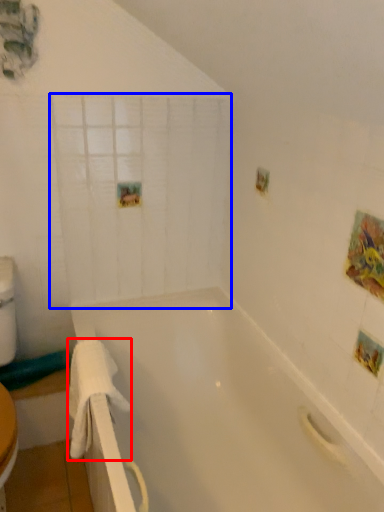
Question: Which object is closer to the camera taking this photo, towel/napkin (highlighted by a red box) or glass door (highlighted by a blue box)?

Choices:
 (A) towel/napkin
 (B) glass door

Answer: (A)